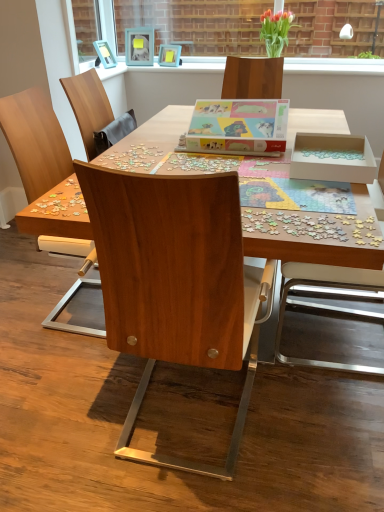
Where is `free space to the left of wooden chair at center, the second chair positioned from the right`? This screenshot has height=512, width=384. free space to the left of wooden chair at center, the second chair positioned from the right is located at coordinates click(55, 413).